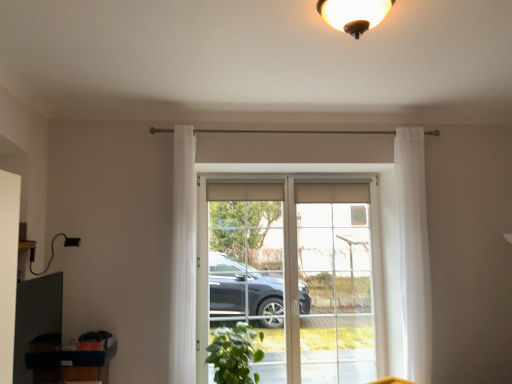
Question: Is clear glass window at center closer to the viewer compared to clear glass door at center?

Choices:
 (A) yes
 (B) no

Answer: (A)

Question: Could clear glass door at center be considered to be inside clear glass window at center?

Choices:
 (A) no
 (B) yes

Answer: (B)

Question: Is clear glass window at center positioned with its back to clear glass door at center?

Choices:
 (A) no
 (B) yes

Answer: (B)

Question: Considering the relative sizes of clear glass window at center and clear glass door at center in the image provided, is clear glass window at center taller than clear glass door at center?

Choices:
 (A) no
 (B) yes

Answer: (A)

Question: Considering the relative sizes of clear glass window at center and clear glass door at center in the image provided, is clear glass window at center wider than clear glass door at center?

Choices:
 (A) yes
 (B) no

Answer: (A)

Question: In the image, is white sheer curtain at right, placed as the 2th curtain when sorted from left to right, on the left side or the right side of white sheer curtain at center, which ranks as the first curtain in left-to-right order?

Choices:
 (A) right
 (B) left

Answer: (A)

Question: From their relative heights in the image, would you say white sheer curtain at right, which is counted as the first curtain, starting from the right, is taller or shorter than white sheer curtain at center, which ranks as the first curtain in left-to-right order?

Choices:
 (A) tall
 (B) short

Answer: (A)

Question: Is white sheer curtain at right, which is counted as the first curtain, starting from the right, in front of or behind white sheer curtain at center, which ranks as the first curtain in left-to-right order, in the image?

Choices:
 (A) front
 (B) behind

Answer: (B)

Question: Based on their sizes in the image, would you say white sheer curtain at right, placed as the 2th curtain when sorted from left to right, is bigger or smaller than white sheer curtain at center, which ranks as the first curtain in left-to-right order?

Choices:
 (A) small
 (B) big

Answer: (B)

Question: Is clear glass window at center to the left or to the right of matte gold light fixture at upper center in the image?

Choices:
 (A) right
 (B) left

Answer: (B)

Question: In terms of width, does clear glass window at center look wider or thinner when compared to matte gold light fixture at upper center?

Choices:
 (A) thin
 (B) wide

Answer: (A)

Question: Considering their positions, is clear glass window at center located in front of or behind matte gold light fixture at upper center?

Choices:
 (A) front
 (B) behind

Answer: (B)

Question: Looking at the image, does clear glass window at center seem bigger or smaller compared to matte gold light fixture at upper center?

Choices:
 (A) big
 (B) small

Answer: (A)

Question: From the image's perspective, is clear glass door at center located above or below clear glass screen door at center?

Choices:
 (A) above
 (B) below

Answer: (B)

Question: In terms of width, does clear glass door at center look wider or thinner when compared to clear glass screen door at center?

Choices:
 (A) wide
 (B) thin

Answer: (A)